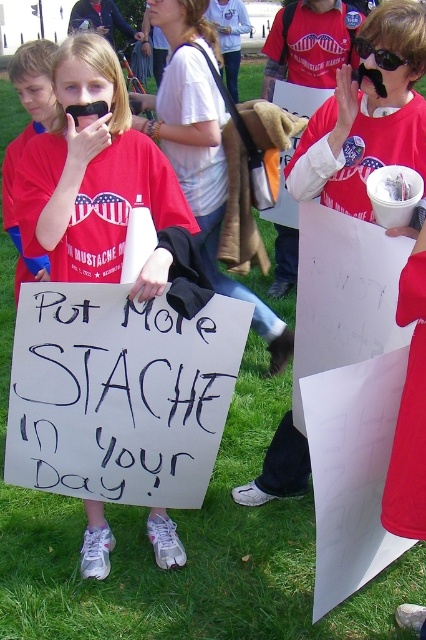
Question: Is matte red t-shirt at center positioned behind white paper sign at center?

Choices:
 (A) yes
 (B) no

Answer: (A)

Question: Does matte red t-shirt at center appear over white paper sign at center?

Choices:
 (A) yes
 (B) no

Answer: (B)

Question: Which point is farther to the camera?

Choices:
 (A) white paper sign at center
 (B) black plastic goggles at upper center

Answer: (B)

Question: Considering the real-world distances, which object is farthest from the white paper sign at center?

Choices:
 (A) black plastic goggles at upper center
 (B) matte red t-shirt at center

Answer: (B)

Question: Which of the following is the farthest from the observer?

Choices:
 (A) (20, 161)
 (B) (362, 51)
 (C) (356, 204)

Answer: (A)

Question: Is matte red t-shirt at center smaller than black plastic goggles at upper center?

Choices:
 (A) no
 (B) yes

Answer: (A)